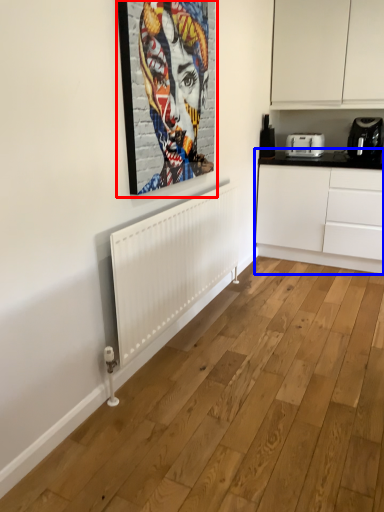
Question: Which point is further to the camera, picture frame (highlighted by a red box) or cabinetry (highlighted by a blue box)?

Choices:
 (A) picture frame
 (B) cabinetry

Answer: (B)